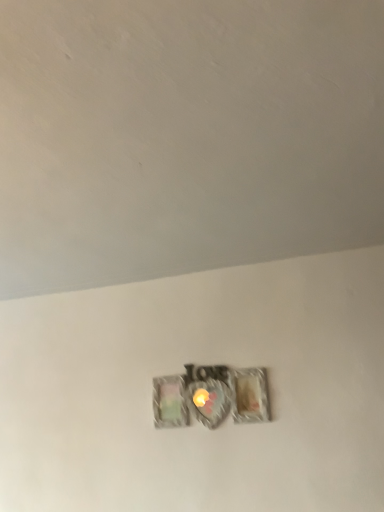
The height and width of the screenshot is (512, 384). What do you see at coordinates (211, 396) in the screenshot? I see `metallic heart-shaped light switch at center` at bounding box center [211, 396].

In order to click on metallic heart-shaped light switch at center in this screenshot , I will do `click(211, 396)`.

Where is `metallic heart-shaped light switch at center`? Image resolution: width=384 pixels, height=512 pixels. metallic heart-shaped light switch at center is located at coordinates (211, 396).